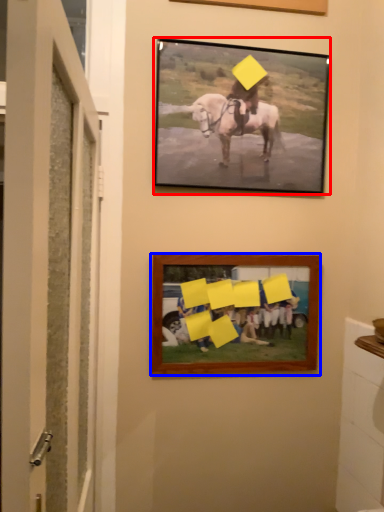
Question: Which of the following is the farthest to the observer, picture frame (highlighted by a red box) or picture frame (highlighted by a blue box)?

Choices:
 (A) picture frame
 (B) picture frame

Answer: (B)